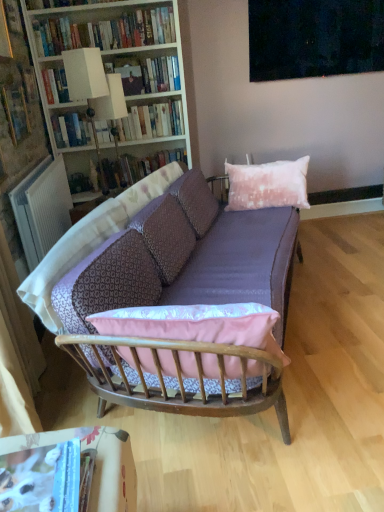
Question: Is white plastic radiator at left facing away from hardcover book at center, which appears as the 1th book when viewed from the back?

Choices:
 (A) yes
 (B) no

Answer: (B)

Question: Is white plastic radiator at left outside hardcover book at center, the sixth book positioned from the front?

Choices:
 (A) no
 (B) yes

Answer: (B)

Question: Is white plastic radiator at left aimed at hardcover book at center, which appears as the 1th book when viewed from the back?

Choices:
 (A) yes
 (B) no

Answer: (A)

Question: Is hardcover book at center, which appears as the 1th book when viewed from the back, located within white plastic radiator at left?

Choices:
 (A) yes
 (B) no

Answer: (B)

Question: Is white plastic radiator at left far from hardcover book at center, which appears as the 1th book when viewed from the back?

Choices:
 (A) no
 (B) yes

Answer: (A)

Question: Is white wood bookcase at upper left situated inside dark matte painting at upper center or outside?

Choices:
 (A) inside
 (B) outside

Answer: (B)

Question: Visually, is white wood bookcase at upper left positioned to the left or to the right of dark matte painting at upper center?

Choices:
 (A) right
 (B) left

Answer: (B)

Question: Considering the positions of point (132, 114) and point (266, 31), is point (132, 114) closer or farther from the camera than point (266, 31)?

Choices:
 (A) closer
 (B) farther

Answer: (B)

Question: From the image's perspective, relative to dark matte painting at upper center, is white wood bookcase at upper left above or below?

Choices:
 (A) above
 (B) below

Answer: (B)

Question: Would you say hardcover book at upper left, positioned as the 4th book in top-to-bottom order, is to the left or to the right of dark matte painting at upper center in the picture?

Choices:
 (A) left
 (B) right

Answer: (A)

Question: From a real-world perspective, is hardcover book at upper left, positioned as the 4th book in top-to-bottom order, positioned above or below dark matte painting at upper center?

Choices:
 (A) above
 (B) below

Answer: (B)

Question: From the image's perspective, is hardcover book at upper left, positioned as the 4th book in top-to-bottom order, above or below dark matte painting at upper center?

Choices:
 (A) above
 (B) below

Answer: (B)

Question: From their relative heights in the image, would you say hardcover book at upper left, the second book when ordered from front to back, is taller or shorter than dark matte painting at upper center?

Choices:
 (A) short
 (B) tall

Answer: (A)

Question: In terms of size, does hardcover book at upper center, the third book positioned from the back, appear bigger or smaller than white wood bookcase at upper left?

Choices:
 (A) big
 (B) small

Answer: (B)

Question: Considering the positions of point (170, 83) and point (56, 96), is point (170, 83) closer or farther from the camera than point (56, 96)?

Choices:
 (A) closer
 (B) farther

Answer: (B)